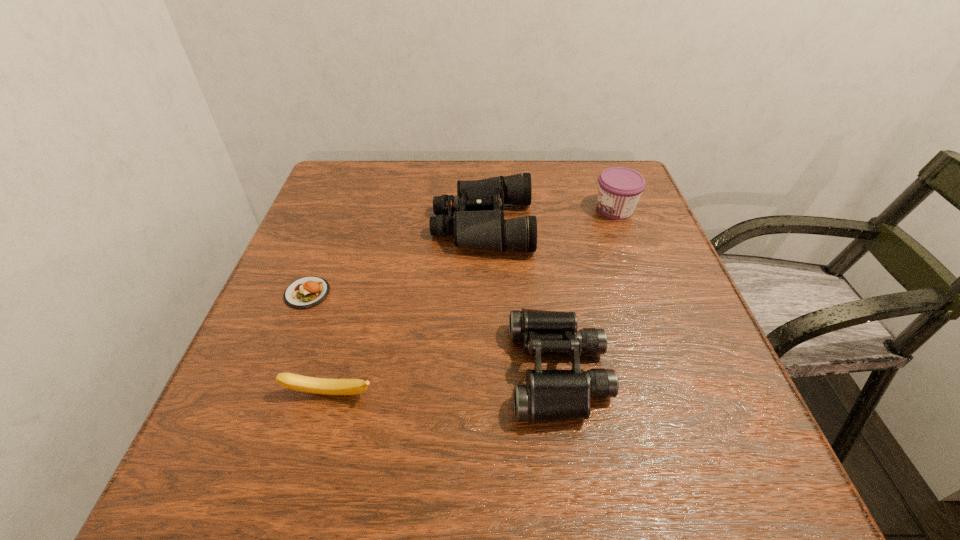
Where is `vacant area between the rightmost object and the nearer binoculars`? This screenshot has height=540, width=960. vacant area between the rightmost object and the nearer binoculars is located at coordinates (587, 291).

This screenshot has width=960, height=540. Identify the location of empty location between the rightmost object and the third farthest object. (461, 251).

You are a GUI agent. You are given a task and a screenshot of the screen. Output one action in this format:
    pyautogui.click(x=<x>, y=<y>)
    Task: Click on the vacant space that is in between the rightmost object and the farther binoculars
    The height and width of the screenshot is (540, 960).
    Given the screenshot: What is the action you would take?
    pyautogui.click(x=549, y=217)

Find the location of a particular element. Image resolution: width=960 pixels, height=540 pixels. vacant area that lies between the farther binoculars and the shortest object is located at coordinates (396, 259).

You are a GUI agent. You are given a task and a screenshot of the screen. Output one action in this format:
    pyautogui.click(x=<x>, y=<y>)
    Task: Click on the free space that is in between the farther binoculars and the nearer binoculars
    The height and width of the screenshot is (540, 960).
    Given the screenshot: What is the action you would take?
    pyautogui.click(x=521, y=298)

This screenshot has width=960, height=540. What are the coordinates of `vacant space that is in between the banana and the jam` in the screenshot? It's located at (472, 302).

You are a GUI agent. You are given a task and a screenshot of the screen. Output one action in this format:
    pyautogui.click(x=<x>, y=<y>)
    Task: Click on the free point between the rightmost object and the nearer binoculars
    
    Given the screenshot: What is the action you would take?
    pyautogui.click(x=587, y=291)

Where is `unoccupied area between the farther binoculars and the nearer binoculars`? This screenshot has height=540, width=960. unoccupied area between the farther binoculars and the nearer binoculars is located at coordinates (521, 298).

Identify the location of object that is the third closest to the shortest object. This screenshot has height=540, width=960. (549, 395).

You are a GUI agent. You are given a task and a screenshot of the screen. Output one action in this format:
    pyautogui.click(x=<x>, y=<y>)
    Task: Click on the second closest object to the jam
    The height and width of the screenshot is (540, 960).
    Given the screenshot: What is the action you would take?
    pyautogui.click(x=549, y=395)